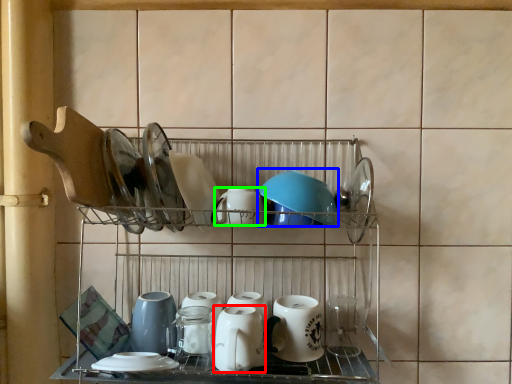
Question: Based on their relative distances, which object is farther from tableware (highlighted by a red box)? Choose from tableware (highlighted by a blue box) and tableware (highlighted by a green box).

Choices:
 (A) tableware
 (B) tableware

Answer: (A)